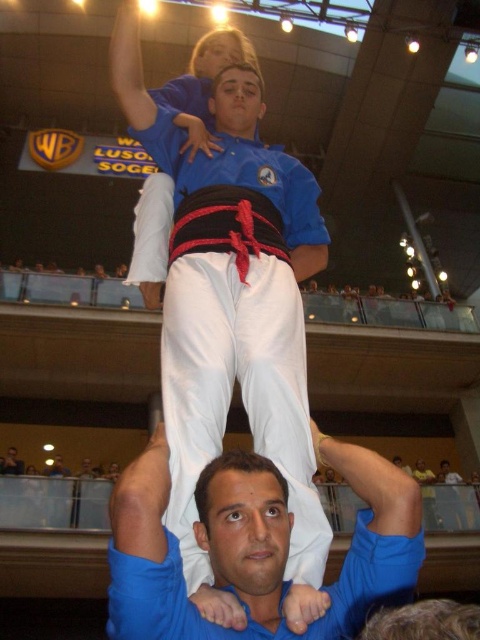
Looking at this image, who is more distant from viewer, (x=396, y=557) or (x=311, y=273)?

The point (x=311, y=273) is more distant.

Is point (376, 522) positioned behind point (199, 609)?

Yes, point (376, 522) is behind point (199, 609).

Is point (386, 577) farther from camera compared to point (254, 88)?

No, (386, 577) is in front of (254, 88).

Locate an element on the screen. Image resolution: width=480 pixels, height=640 pixels. white cotton pants at lower center is located at coordinates [254, 545].